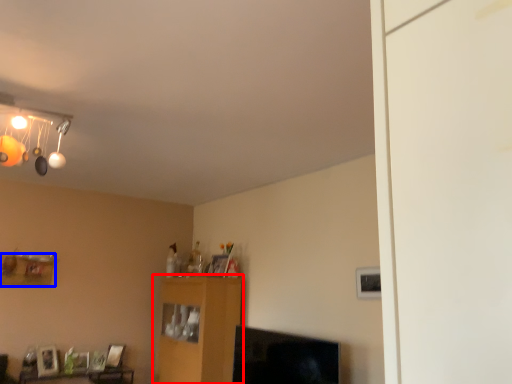
Question: Which object is further to the camera taking this photo, furniture (highlighted by a red box) or shelf (highlighted by a blue box)?

Choices:
 (A) furniture
 (B) shelf

Answer: (B)